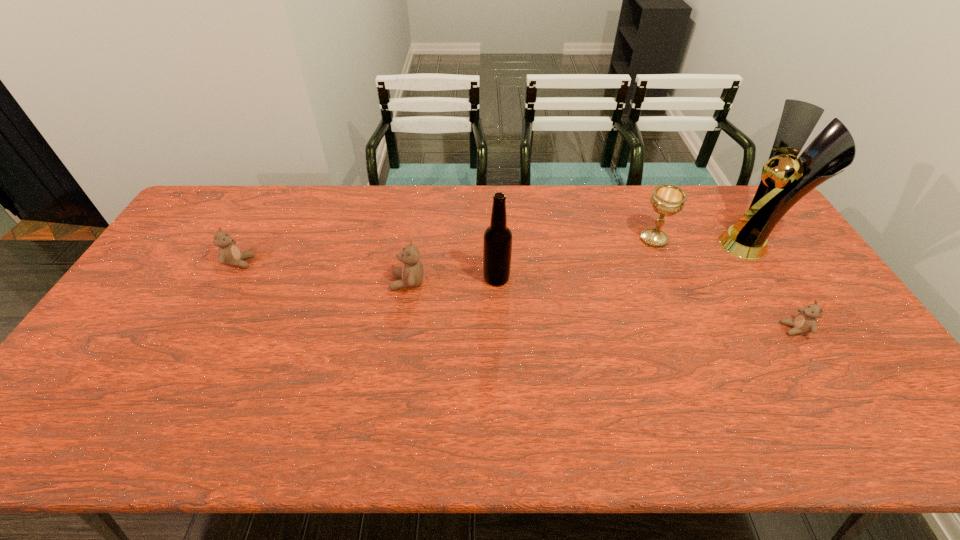
Locate an element on the screen. the leftmost object is located at coordinates (229, 254).

Image resolution: width=960 pixels, height=540 pixels. I want to click on the second shortest teddy bear, so click(x=229, y=254).

The height and width of the screenshot is (540, 960). I want to click on the third shortest object, so click(x=411, y=274).

Identify the location of the second teddy bear from left to right. (411, 274).

The height and width of the screenshot is (540, 960). Identify the location of the rightmost teddy bear. (805, 322).

At what (x,y) coordinates should I click in order to perform the action: click on the shortest teddy bear. Please return your answer as a coordinate pair (x, y). This screenshot has width=960, height=540. Looking at the image, I should click on (805, 322).

Locate an element on the screen. This screenshot has width=960, height=540. chalice is located at coordinates (668, 200).

Locate an element on the screen. This screenshot has width=960, height=540. the third tallest object is located at coordinates (668, 200).

Identify the location of award. (784, 181).

The height and width of the screenshot is (540, 960). In order to click on the fifth shortest object in this screenshot , I will do `click(497, 245)`.